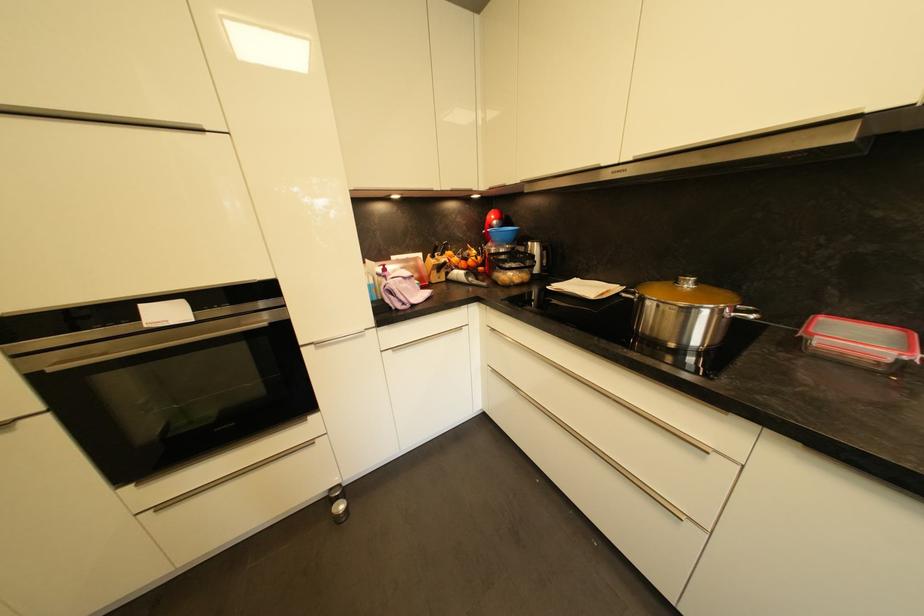
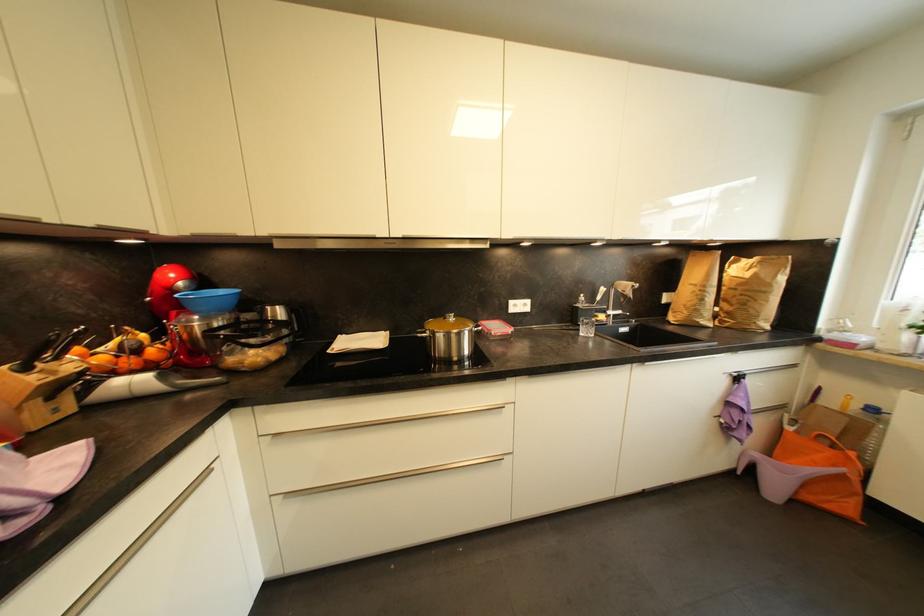
Question: Based on the continuous images, in which direction is the camera rotating? Reply with the corresponding letter.

Choices:
 (A) Left
 (B) Right
 (C) Up
 (D) Down

Answer: (B)